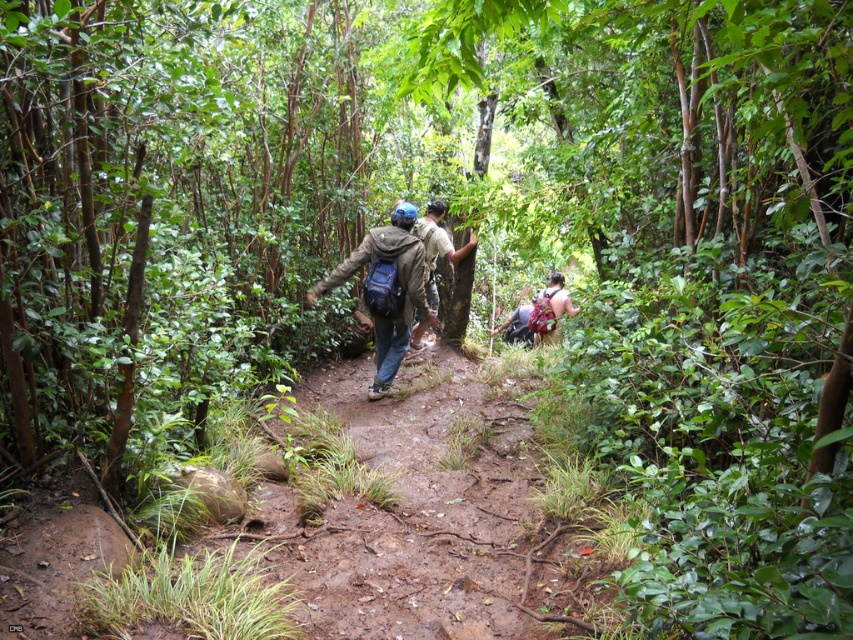
Can you confirm if matte green jacket at center is positioned to the right of camouflage fabric backpack at center?

No, matte green jacket at center is not to the right of camouflage fabric backpack at center.

Find the location of `matte green jacket at center`. matte green jacket at center is located at coordinates (386, 291).

This screenshot has width=853, height=640. Describe the element at coordinates (437, 248) in the screenshot. I see `matte blue backpack at center` at that location.

Can you confirm if matte blue backpack at center is positioned to the left of camouflage fabric backpack at center?

Correct, you'll find matte blue backpack at center to the left of camouflage fabric backpack at center.

Between point (428, 262) and point (547, 298), which one is positioned in front?

Point (428, 262) is more forward.

I want to click on matte blue backpack at center, so click(437, 248).

Is matte green jacket at center thinner than matte blue backpack at center?

No, matte green jacket at center is not thinner than matte blue backpack at center.

Who is more distant from viewer, [428,323] or [471,237]?

Positioned behind is point [471,237].

The width and height of the screenshot is (853, 640). I want to click on matte green jacket at center, so click(x=386, y=291).